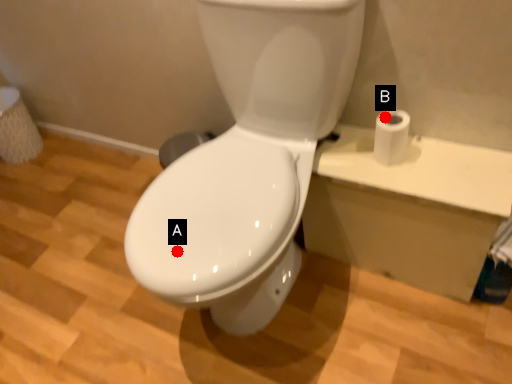
Question: Two points are circled on the image, labeled by A and B beside each circle. Which point is farther to the camera?

Choices:
 (A) A is further
 (B) B is further

Answer: (B)